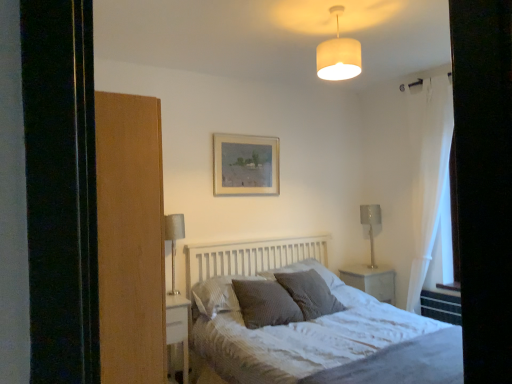
Locate an element on the screen. white wood bed at center is located at coordinates (316, 328).

This screenshot has width=512, height=384. Describe the element at coordinates (371, 225) in the screenshot. I see `metallic silver table lamp at right, which appears as the second table lamp when viewed from the left` at that location.

Locate an element on the screen. textured gray pillow at center, which is counted as the third pillow, starting from the left is located at coordinates (307, 270).

At what (x,y) coordinates should I click in order to perform the action: click on textured gray pillow at center, the third pillow positioned from the right. Please return your answer as a coordinate pair (x, y). The height and width of the screenshot is (384, 512). Looking at the image, I should click on (265, 303).

Considering the relative positions of textured gray pillow at center, the third pillow positioned from the right, and brown wood screen door at left in the image provided, is textured gray pillow at center, the third pillow positioned from the right, to the left or to the right of brown wood screen door at left?

Clearly, textured gray pillow at center, the third pillow positioned from the right, is on the right of brown wood screen door at left in the image.

Between textured gray pillow at center, the third pillow positioned from the right, and brown wood screen door at left, which one has smaller width?

Thinner between the two is brown wood screen door at left.

Are textured gray pillow at center, marked as the 2th pillow in a left-to-right arrangement, and brown wood screen door at left beside each other?

No, textured gray pillow at center, marked as the 2th pillow in a left-to-right arrangement, is not making contact with brown wood screen door at left.

From the picture: From the image's perspective, is textured gray pillow at center, the third pillow positioned from the right, under brown wood screen door at left?

Yes, from the image's perspective, textured gray pillow at center, the third pillow positioned from the right, is below brown wood screen door at left.

From a real-world perspective, is silver metallic table lamp at left, positioned as the 2th table lamp in back-to-front order, positioned above or below dark grey textured pillow at center, the fourth pillow from the right?

From a real-world perspective, silver metallic table lamp at left, positioned as the 2th table lamp in back-to-front order, is physically above dark grey textured pillow at center, the fourth pillow from the right.

Is point (174, 251) positioned after point (193, 288)?

Yes.

Is dark grey textured pillow at center, the first pillow from the left, at the back of silver metallic table lamp at left, positioned as the 2th table lamp in back-to-front order?

No.

Is the depth of silver metallic table lamp at left, positioned as the 2th table lamp in back-to-front order, less than that of dark grey textured pillow at center, the first pillow from the left?

No.

Considering the points (101, 111) and (373, 245), which point is behind, point (101, 111) or point (373, 245)?

Positioned behind is point (373, 245).

Is brown wood screen door at left taller or shorter than metallic silver table lamp at right, the first table lamp when ordered from back to front?

Considering their sizes, brown wood screen door at left has more height than metallic silver table lamp at right, the first table lamp when ordered from back to front.

How much distance is there between brown wood screen door at left and metallic silver table lamp at right, arranged as the second table lamp when viewed from the front?

2.74 meters.

Is brown wood screen door at left aimed at metallic silver table lamp at right, the first table lamp when ordered from back to front?

No, brown wood screen door at left is not turned towards metallic silver table lamp at right, the first table lamp when ordered from back to front.

Is textured gray pillow at center, which is counted as the third pillow, starting from the left, bigger or smaller than white glossy nightstand at lower left, which ranks as the 2th nightstand in right-to-left order?

Clearly, textured gray pillow at center, which is counted as the third pillow, starting from the left, is larger in size than white glossy nightstand at lower left, which ranks as the 2th nightstand in right-to-left order.

From a real-world perspective, is textured gray pillow at center, which is the 2th pillow in right-to-left order, physically located above or below white glossy nightstand at lower left, placed as the first nightstand when sorted from front to back?

textured gray pillow at center, which is the 2th pillow in right-to-left order, is situated higher than white glossy nightstand at lower left, placed as the first nightstand when sorted from front to back, in the real world.

Locate an element on the screen. the 4th pillow behind the white glossy nightstand at lower left, placed as the 1th nightstand when sorted from left to right, counting from the anchor's position is located at coordinates (307, 270).

Is textured gray pillow at center, the third pillow positioned from the right, completely or partially inside white fabric lampshade at upper center?

No, textured gray pillow at center, the third pillow positioned from the right, is not a part of white fabric lampshade at upper center.

How different are the orientations of white fabric lampshade at upper center and textured gray pillow at center, the third pillow positioned from the right, in degrees?

0.325 degrees.

Between point (340, 78) and point (277, 295), which one is positioned in front?

The point (340, 78) is more forward.

Looking at this image, from the image's perspective, relative to textured gray pillow at center, the third pillow positioned from the right, is white fabric lampshade at upper center above or below?

From the image's perspective, white fabric lampshade at upper center appears above textured gray pillow at center, the third pillow positioned from the right.

Is white wood bed at center facing away from white glossy nightstand at center, the second nightstand positioned from the left?

white wood bed at center is not turned away from white glossy nightstand at center, the second nightstand positioned from the left.

Between point (264, 251) and point (389, 281), which one is positioned behind?

Point (389, 281)

From the image's perspective, relative to white glossy nightstand at center, the first nightstand viewed from the back, is white wood bed at center above or below?

Based on their image positions, white wood bed at center is located beneath white glossy nightstand at center, the first nightstand viewed from the back.

From the image's perspective, which one is positioned lower, metallic silver table lamp at right, which appears as the second table lamp when viewed from the left, or textured gray pillow at center, which ranks as the fourth pillow in left-to-right order?

textured gray pillow at center, which ranks as the fourth pillow in left-to-right order.

Which object is closer to the camera, metallic silver table lamp at right, the first table lamp when ordered from back to front, or textured gray pillow at center, which is the first pillow from right to left?

textured gray pillow at center, which is the first pillow from right to left.

Which of these two, metallic silver table lamp at right, acting as the 1th table lamp starting from the right, or textured gray pillow at center, which is the first pillow from right to left, stands taller?

Standing taller between the two is metallic silver table lamp at right, acting as the 1th table lamp starting from the right.

Is metallic silver table lamp at right, which appears as the second table lamp when viewed from the left, oriented away from textured gray pillow at center, which is the first pillow from right to left?

Answer: No, metallic silver table lamp at right, which appears as the second table lamp when viewed from the left, is not facing away from textured gray pillow at center, which is the first pillow from right to left.

From the image's perspective, which pillow is the 4th one below the brown wood screen door at left? Please provide its 2D coordinates.

[(265, 303)]

From the image's perspective, count 1st table lamps upward from the dark grey textured pillow at center, the first pillow from the left, and point to it. Please provide its 2D coordinates.

[(174, 240)]

From the image, which object appears to be nearer to textured gray pillow at center, which is the 2th pillow in right-to-left order, wooden picture frame at upper center or silver metallic table lamp at left, positioned as the 2th table lamp in back-to-front order?

wooden picture frame at upper center is closer to textured gray pillow at center, which is the 2th pillow in right-to-left order.

Estimate the real-world distances between objects in this image. Which object is closer to textured gray pillow at center, which is the first pillow from right to left, white sheer curtain at right or silver metallic table lamp at left, placed as the first table lamp when sorted from left to right?

silver metallic table lamp at left, placed as the first table lamp when sorted from left to right.

Looking at the image, which one is located further to metallic silver table lamp at right, acting as the 1th table lamp starting from the right, white glossy nightstand at lower left, which ranks as the 2th nightstand in right-to-left order, or white fabric lampshade at upper center?

The object further to metallic silver table lamp at right, acting as the 1th table lamp starting from the right, is white glossy nightstand at lower left, which ranks as the 2th nightstand in right-to-left order.

From the picture: Looking at the image, which one is located closer to metallic silver table lamp at right, the first table lamp when ordered from back to front, white wood bed at center or white glossy nightstand at center, the 2th nightstand positioned from the front?

Based on the image, white glossy nightstand at center, the 2th nightstand positioned from the front, appears to be nearer to metallic silver table lamp at right, the first table lamp when ordered from back to front.

Based on their spatial positions, is textured gray pillow at center, which is the first pillow from right to left, or white sheer curtain at right closer to white fabric lampshade at upper center?

Based on the image, white sheer curtain at right appears to be nearer to white fabric lampshade at upper center.

Which object lies further to the anchor point silver metallic table lamp at left, positioned as the 2th table lamp in back-to-front order, textured gray pillow at center, which is counted as the third pillow, starting from the left, or textured gray pillow at center, the third pillow positioned from the right?

textured gray pillow at center, which is counted as the third pillow, starting from the left.

Which object lies nearer to the anchor point brown wood screen door at left, white glossy nightstand at lower left, which is the 2th nightstand from back to front, or white fabric lampshade at upper center?

white glossy nightstand at lower left, which is the 2th nightstand from back to front, is closer to brown wood screen door at left.

From the image, which object appears to be farther from metallic silver table lamp at right, acting as the 1th table lamp starting from the right, white glossy nightstand at center, the first nightstand viewed from the back, or silver metallic table lamp at left, the 2th table lamp positioned from the right?

silver metallic table lamp at left, the 2th table lamp positioned from the right, is positioned further to the anchor metallic silver table lamp at right, acting as the 1th table lamp starting from the right.

The height and width of the screenshot is (384, 512). Identify the location of picture frame between silver metallic table lamp at left, positioned as the 2th table lamp in back-to-front order, and white sheer curtain at right from left to right. (246, 165).

Identify the location of picture frame between white glossy nightstand at lower left, which is the 2th nightstand from back to front, and white sheer curtain at right. (246, 165).

Locate an element on the screen. curtain located between brown wood screen door at left and textured gray pillow at center, which is counted as the third pillow, starting from the left, in the depth direction is located at coordinates (431, 184).

At what (x,y) coordinates should I click in order to perform the action: click on table lamp between brown wood screen door at left and white sheer curtain at right from front to back. Please return your answer as a coordinate pair (x, y). Looking at the image, I should click on (174, 240).